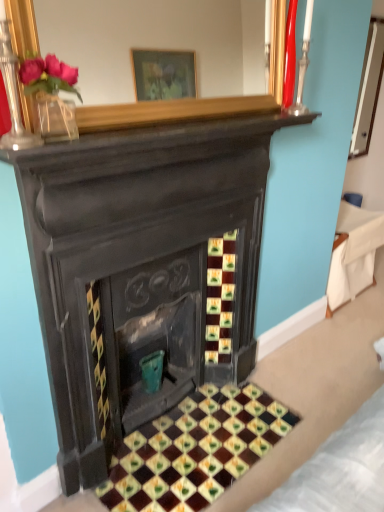
Question: Is teal ceramic vase at center facing away from white fabric at right?

Choices:
 (A) no
 (B) yes

Answer: (A)

Question: From the image's perspective, does teal ceramic vase at center appear higher than white fabric at right?

Choices:
 (A) no
 (B) yes

Answer: (A)

Question: Considering the relative positions of teal ceramic vase at center and white fabric at right in the image provided, is teal ceramic vase at center to the left of white fabric at right from the viewer's perspective?

Choices:
 (A) yes
 (B) no

Answer: (A)

Question: From a real-world perspective, is teal ceramic vase at center beneath white fabric at right?

Choices:
 (A) no
 (B) yes

Answer: (B)

Question: Is teal ceramic vase at center bigger than white fabric at right?

Choices:
 (A) yes
 (B) no

Answer: (B)

Question: Considering the positions of teal ceramic vase at center and glazed ceramic tiles at center in the image, is teal ceramic vase at center taller or shorter than glazed ceramic tiles at center?

Choices:
 (A) short
 (B) tall

Answer: (B)

Question: Considering the positions of teal ceramic vase at center and glazed ceramic tiles at center in the image, is teal ceramic vase at center wider or thinner than glazed ceramic tiles at center?

Choices:
 (A) wide
 (B) thin

Answer: (B)

Question: From the image's perspective, is teal ceramic vase at center located above or below glazed ceramic tiles at center?

Choices:
 (A) above
 (B) below

Answer: (A)

Question: Is teal ceramic vase at center bigger or smaller than glazed ceramic tiles at center?

Choices:
 (A) big
 (B) small

Answer: (B)

Question: Considering the positions of white fabric at right and teal ceramic vase at center in the image, is white fabric at right taller or shorter than teal ceramic vase at center?

Choices:
 (A) short
 (B) tall

Answer: (B)

Question: From the image's perspective, relative to teal ceramic vase at center, is white fabric at right above or below?

Choices:
 (A) above
 (B) below

Answer: (A)

Question: Which is correct: white fabric at right is inside teal ceramic vase at center, or outside of it?

Choices:
 (A) inside
 (B) outside

Answer: (B)

Question: Is point (364, 278) closer or farther from the camera than point (155, 368)?

Choices:
 (A) farther
 (B) closer

Answer: (A)

Question: From the image's perspective, is teal ceramic vase at center located above or below white fabric at right?

Choices:
 (A) below
 (B) above

Answer: (A)

Question: Is teal ceramic vase at center taller or shorter than white fabric at right?

Choices:
 (A) tall
 (B) short

Answer: (B)